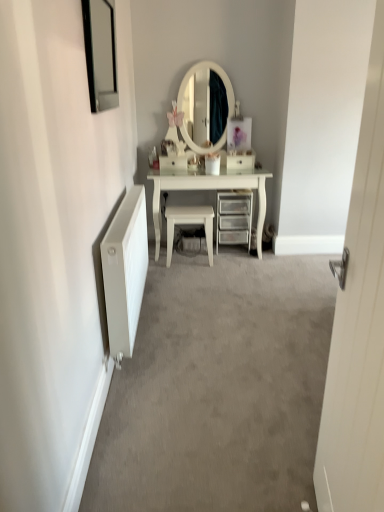
At what (x,y) coordinates should I click in order to perform the action: click on vacant point above white matte radiator at left (from a real-world perspective). Please return your answer as a coordinate pair (x, y). Looking at the image, I should click on (121, 205).